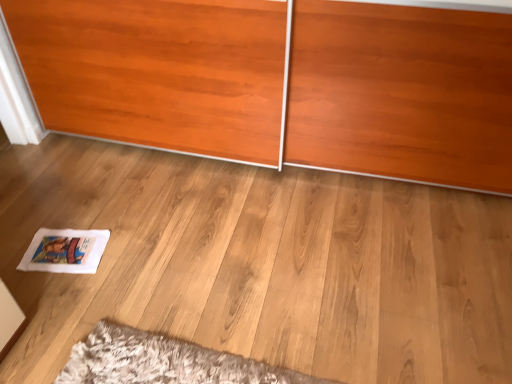
Question: Considering the relative sizes of white paper magazine at lower left and matte wood wardrobe at center in the image provided, is white paper magazine at lower left shorter than matte wood wardrobe at center?

Choices:
 (A) no
 (B) yes

Answer: (B)

Question: Does white paper magazine at lower left have a greater width compared to matte wood wardrobe at center?

Choices:
 (A) yes
 (B) no

Answer: (B)

Question: Is white paper magazine at lower left closer to camera compared to matte wood wardrobe at center?

Choices:
 (A) yes
 (B) no

Answer: (B)

Question: From a real-world perspective, is white paper magazine at lower left on matte wood wardrobe at center?

Choices:
 (A) no
 (B) yes

Answer: (A)

Question: Is white paper magazine at lower left oriented towards matte wood wardrobe at center?

Choices:
 (A) no
 (B) yes

Answer: (A)

Question: Can you confirm if white paper magazine at lower left is thinner than matte wood wardrobe at center?

Choices:
 (A) no
 (B) yes

Answer: (B)

Question: Does matte wood wardrobe at center have a lesser width compared to white paper magazine at lower left?

Choices:
 (A) yes
 (B) no

Answer: (B)

Question: Can you confirm if matte wood wardrobe at center is positioned to the right of white paper magazine at lower left?

Choices:
 (A) no
 (B) yes

Answer: (B)

Question: Are matte wood wardrobe at center and white paper magazine at lower left located far from each other?

Choices:
 (A) no
 (B) yes

Answer: (A)

Question: Is matte wood wardrobe at center aimed at white paper magazine at lower left?

Choices:
 (A) no
 (B) yes

Answer: (B)

Question: From the image's perspective, is matte wood wardrobe at center above white paper magazine at lower left?

Choices:
 (A) no
 (B) yes

Answer: (B)

Question: Is matte wood wardrobe at center facing away from white paper magazine at lower left?

Choices:
 (A) yes
 (B) no

Answer: (B)

Question: Is white paper magazine at lower left bigger or smaller than matte wood wardrobe at center?

Choices:
 (A) big
 (B) small

Answer: (B)